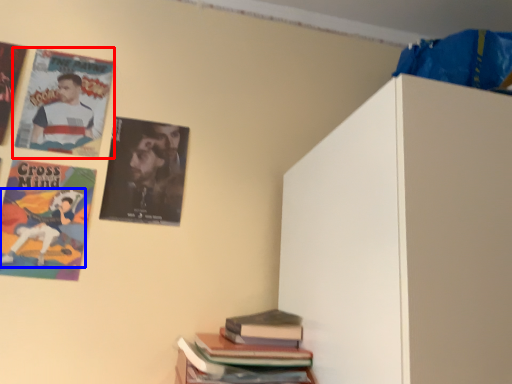
Question: Which of the following is the closest to the observer, poster (highlighted by a red box) or person (highlighted by a blue box)?

Choices:
 (A) poster
 (B) person

Answer: (B)